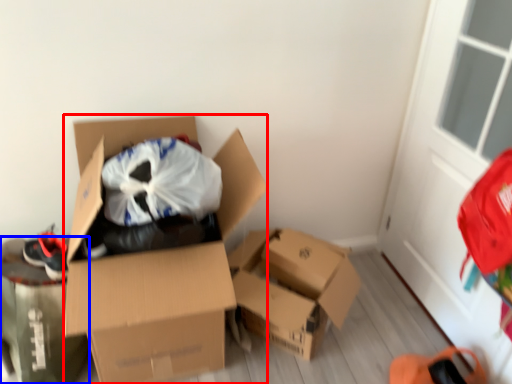
Question: Which of the following is the farthest to the observer, box (highlighted by a red box) or cardboard box (highlighted by a blue box)?

Choices:
 (A) box
 (B) cardboard box

Answer: (B)